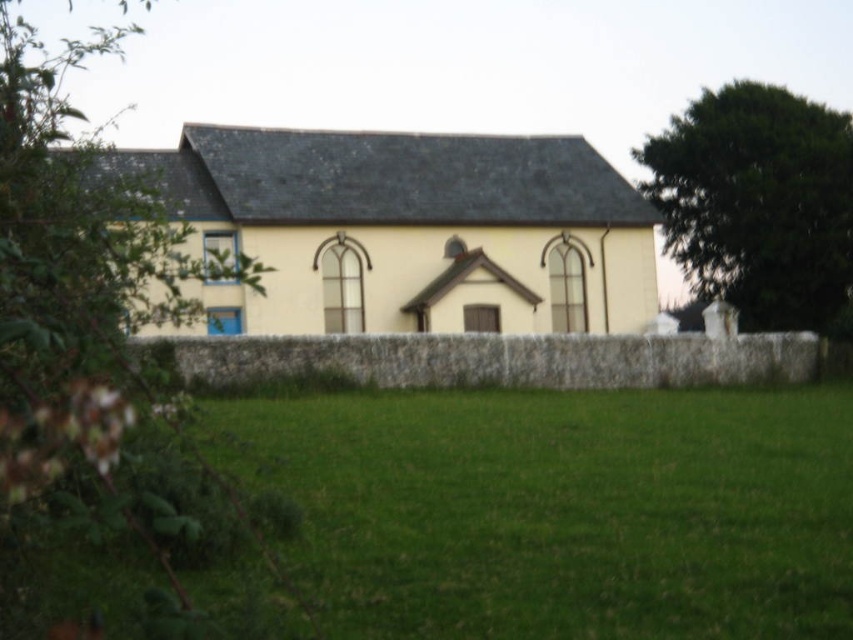
You are standing at the front of the building and want to walk to the green grass at lower center. According to the coordinates provided, in which direction should you move from your current position?

The green grass at lower center is located at coordinates point (x=561, y=509). Since the lower center position is typically below the central area, you should move downward from the building towards the green grass at lower center.

You are standing in the middle of the lawn looking towards the yellow matte church at center and the dark green leafy tree at upper right. Which object is closer to your left side?

The yellow matte church at center is closer to your left side as it is positioned to the left of the dark green leafy tree at upper right.